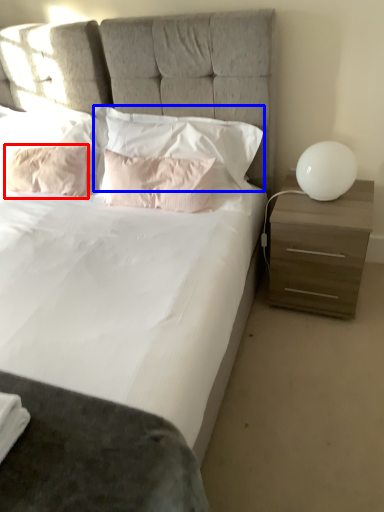
Question: Which of the following is the closest to the observer, pillow (highlighted by a red box) or pillow (highlighted by a blue box)?

Choices:
 (A) pillow
 (B) pillow

Answer: (B)